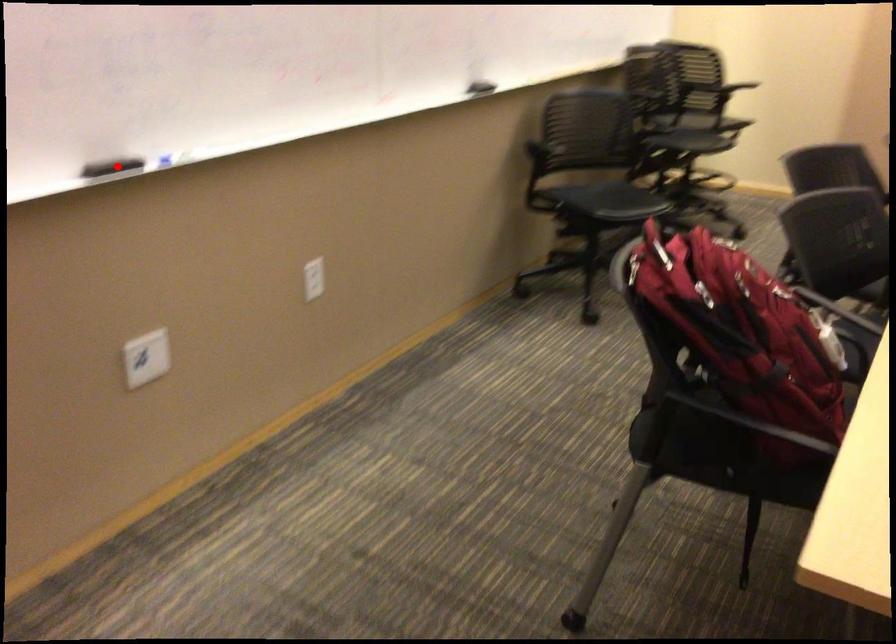
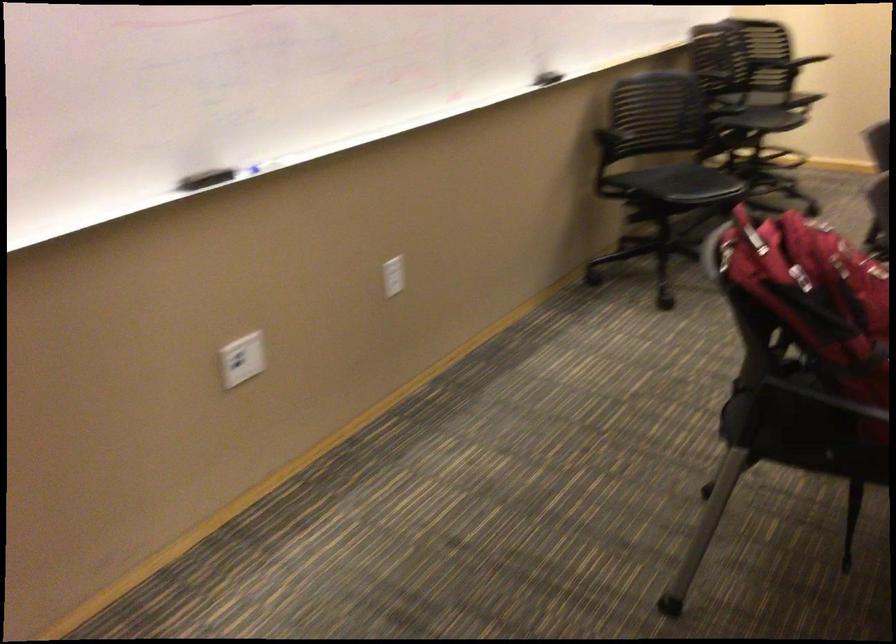
The point at the highlighted location is marked in the first image. Where is the corresponding point in the second image?

(204, 178)